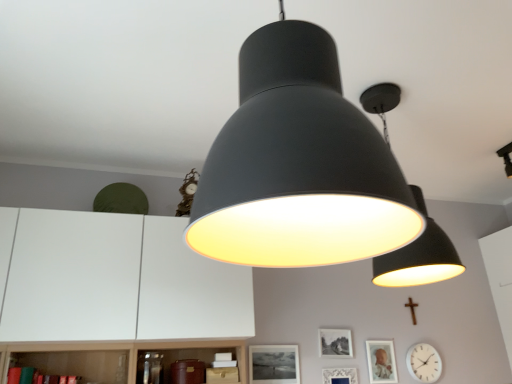
Question: From the image's perspective, is wooden cross at lower right positioned above or below matte black lampshade at upper center, which appears as the 2th lamp when viewed from the left?

Choices:
 (A) below
 (B) above

Answer: (A)

Question: From their relative heights in the image, would you say wooden cross at lower right is taller or shorter than matte black lampshade at upper center, which appears as the 2th lamp when viewed from the left?

Choices:
 (A) short
 (B) tall

Answer: (A)

Question: Considering the real-world distances, which object is closest to the matte white picture frame at center, acting as the 2th picture frame starting from the right?

Choices:
 (A) matte black lampshade at center, which ranks as the second lamp in right-to-left order
 (B) black matte picture frame at center, which ranks as the 1th picture frame in left-to-right order
 (C) matte silver picture frame at lower right, the fourth picture frame positioned from the left
 (D) matte black lampshade at upper center, the 2th lamp viewed from the front
 (E) white glossy clock at lower right

Answer: (C)

Question: Estimate the real-world distances between objects in this image. Which object is farther from the matte black lampshade at center, which ranks as the second lamp in right-to-left order?

Choices:
 (A) black matte picture frame at center, which ranks as the 1th picture frame in left-to-right order
 (B) matte silver picture frame at lower right, the 1th picture frame from the right
 (C) white glossy clock at lower right
 (D) matte white picture frame at center, acting as the 2th picture frame starting from the right
 (E) matte black lampshade at upper center, which appears as the 2th lamp when viewed from the left

Answer: (C)